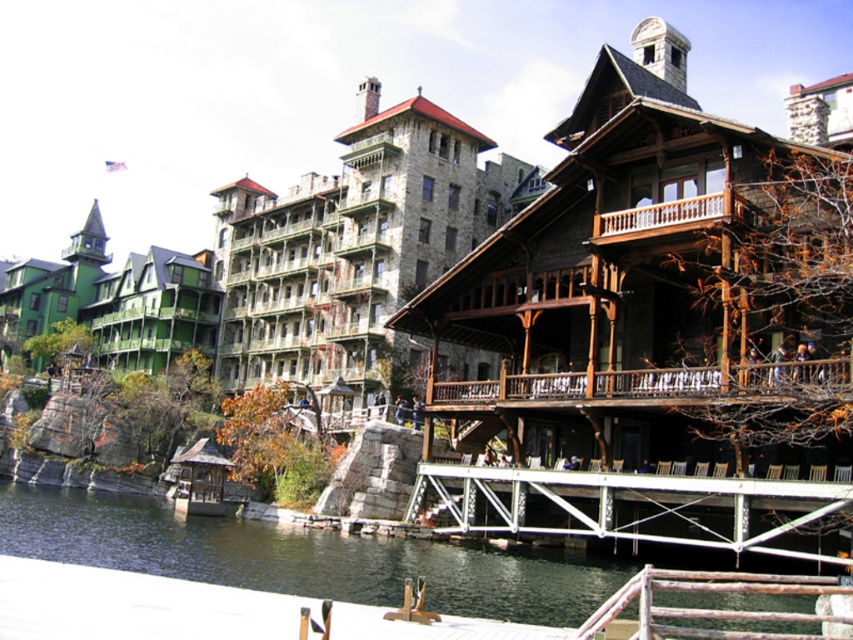
Can you confirm if dark green water at lower left is wider than brown wooden railing at center?

Yes, dark green water at lower left is wider than brown wooden railing at center.

Which is more to the right, dark green water at lower left or brown wooden railing at center?

Positioned to the right is brown wooden railing at center.

Between point (540, 548) and point (799, 388), which one is positioned behind?

Point (540, 548)

Where is `dark green water at lower left`? This screenshot has height=640, width=853. dark green water at lower left is located at coordinates (305, 554).

Which of these two, dark green water at lower left or white metal dock at lower center, stands shorter?

white metal dock at lower center

Is dark green water at lower left thinner than white metal dock at lower center?

No, dark green water at lower left is not thinner than white metal dock at lower center.

Does point (306, 588) lie in front of point (656, 506)?

Yes, point (306, 588) is closer to viewer.

This screenshot has width=853, height=640. In order to click on dark green water at lower left in this screenshot , I will do `click(305, 554)`.

Is white metal dock at lower center closer to camera compared to brown wooden railing at center?

Yes, white metal dock at lower center is in front of brown wooden railing at center.

Who is lower down, white metal dock at lower center or brown wooden railing at center?

white metal dock at lower center is lower down.

Is point (682, 532) behind point (657, 378)?

Yes, it is.

Image resolution: width=853 pixels, height=640 pixels. I want to click on white metal dock at lower center, so click(x=635, y=508).